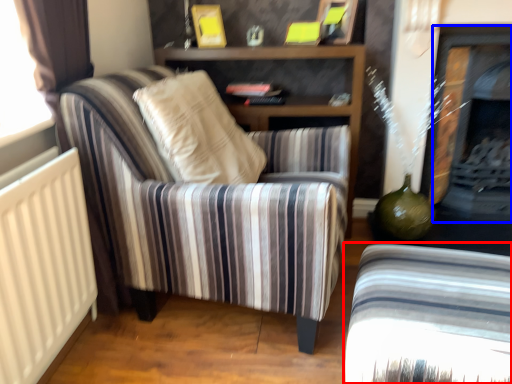
Question: Which point is closer to the camera, chair (highlighted by a red box) or fireplace (highlighted by a blue box)?

Choices:
 (A) chair
 (B) fireplace

Answer: (A)